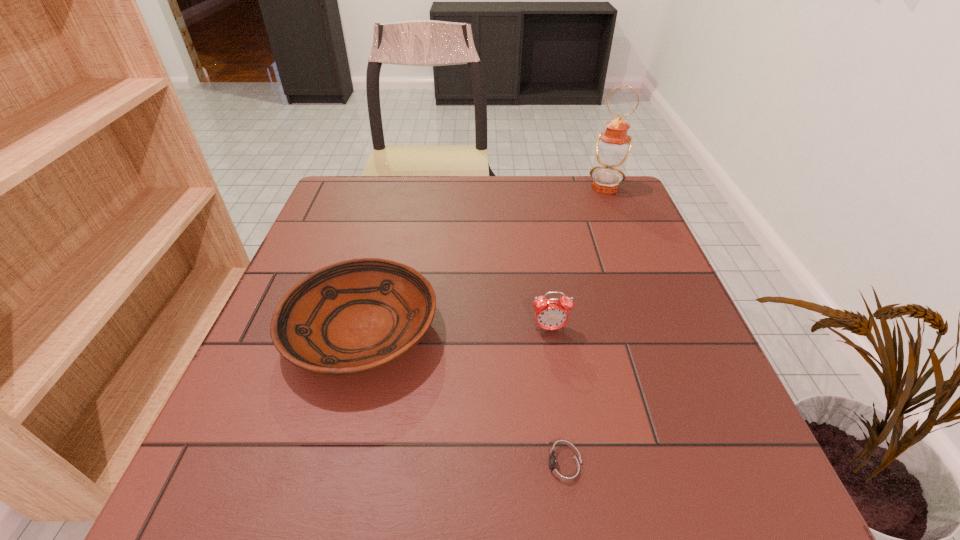
Identify the location of free spot at the left edge of the desktop. (257, 352).

Identify the location of free space at the right edge. (668, 336).

Identify the location of vacant position at the far left corner of the desktop. (380, 185).

Find the location of a particular element. vacant space at the near left corner of the desktop is located at coordinates (214, 478).

Where is `blank space at the far right corner of the desktop`? The image size is (960, 540). blank space at the far right corner of the desktop is located at coordinates click(x=623, y=205).

What are the coordinates of `vacant area that lies between the alarm clock and the farthest object` in the screenshot? It's located at (577, 259).

Locate an element on the screen. The height and width of the screenshot is (540, 960). vacant area that lies between the farthest object and the alarm clock is located at coordinates (577, 259).

This screenshot has width=960, height=540. In order to click on vacant area that lies between the nearest object and the leftmost object in this screenshot , I will do `click(463, 399)`.

The width and height of the screenshot is (960, 540). I want to click on vacant space in between the rightmost object and the alarm clock, so click(577, 259).

Where is `free space between the oil lamp and the plate`? The image size is (960, 540). free space between the oil lamp and the plate is located at coordinates 483,259.